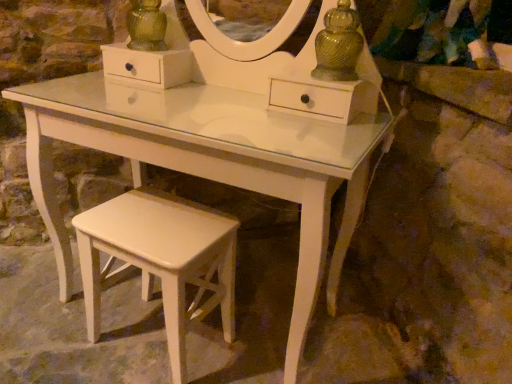
Find the location of a particular element. The width and height of the screenshot is (512, 384). free space underneath white painted wood stool at lower left (from a real-world perspective) is located at coordinates tap(157, 342).